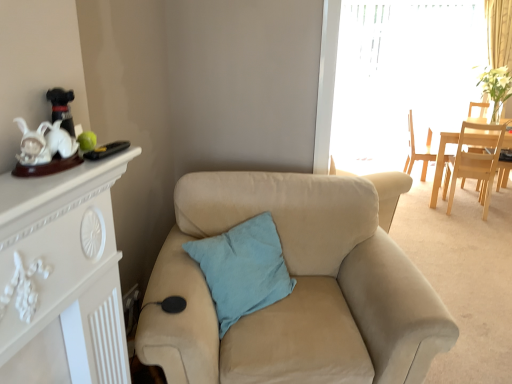
Question: From the image's perspective, relative to beige fabric armchair at center, is transparent plastic window screen at upper right above or below?

Choices:
 (A) above
 (B) below

Answer: (A)

Question: Considering the positions of transparent plastic window screen at upper right and beige fabric armchair at center in the image, is transparent plastic window screen at upper right bigger or smaller than beige fabric armchair at center?

Choices:
 (A) big
 (B) small

Answer: (A)

Question: Which object is the closest to the light wood chair at upper right, which is the first chair in back-to-front order?

Choices:
 (A) teal fabric pillow at center
 (B) beige fabric armchair at center
 (C) light wood chair at right, the second chair positioned from the back
 (D) light blue cotton pillow at center
 (E) beige fabric couch at center

Answer: (C)

Question: Which is nearer to the teal fabric pillow at center?

Choices:
 (A) beige fabric couch at center
 (B) transparent plastic window screen at upper right
 (C) light wood chair at upper right, which is the first chair in back-to-front order
 (D) light wood chair at right, which is the first chair from front to back
 (E) light blue cotton pillow at center

Answer: (E)